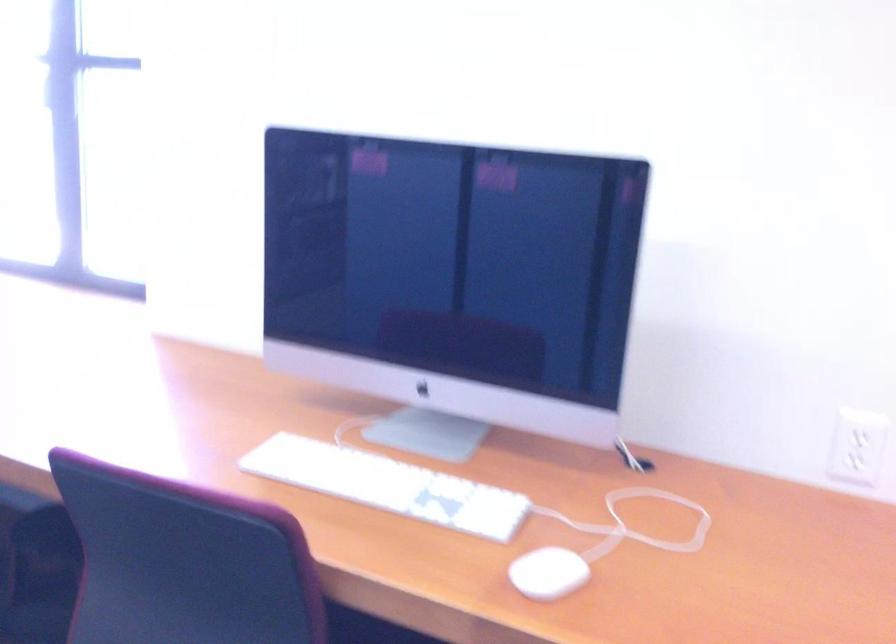
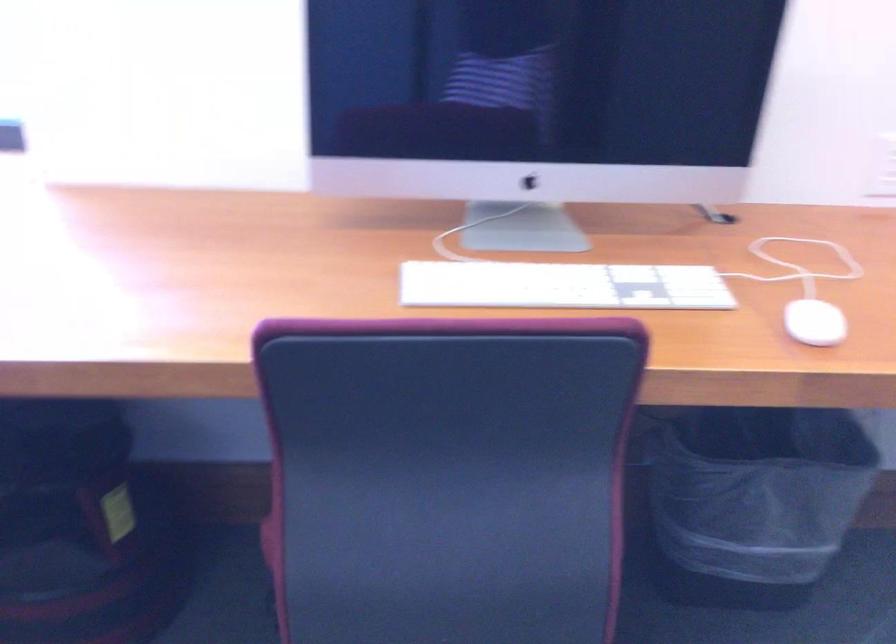
The point at [530,574] is marked in the first image. Where is the corresponding point in the second image?

(814, 323)